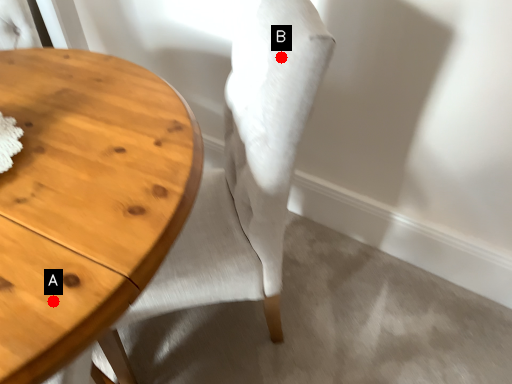
Question: Two points are circled on the image, labeled by A and B beside each circle. Which of the following is the farthest from the observer?

Choices:
 (A) A is further
 (B) B is further

Answer: (B)